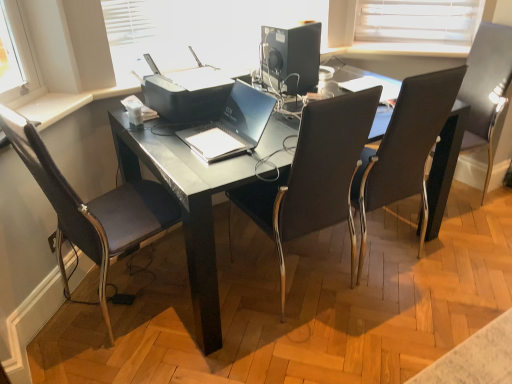
Locate an element on the screen. The image size is (512, 384). vacant space that is to the left of satin black laptop at center is located at coordinates (160, 139).